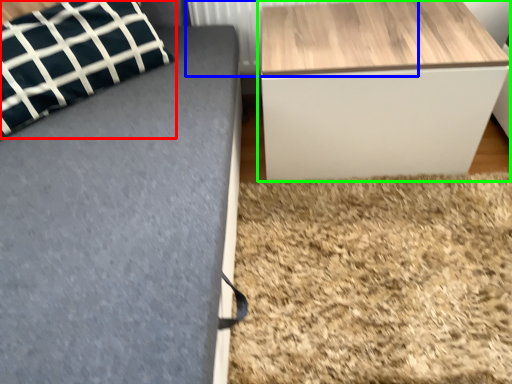
Question: Which object is the farthest from pillow (highlighted by a red box)? Choose among these: radiator (highlighted by a blue box) or table (highlighted by a green box).

Choices:
 (A) radiator
 (B) table

Answer: (B)